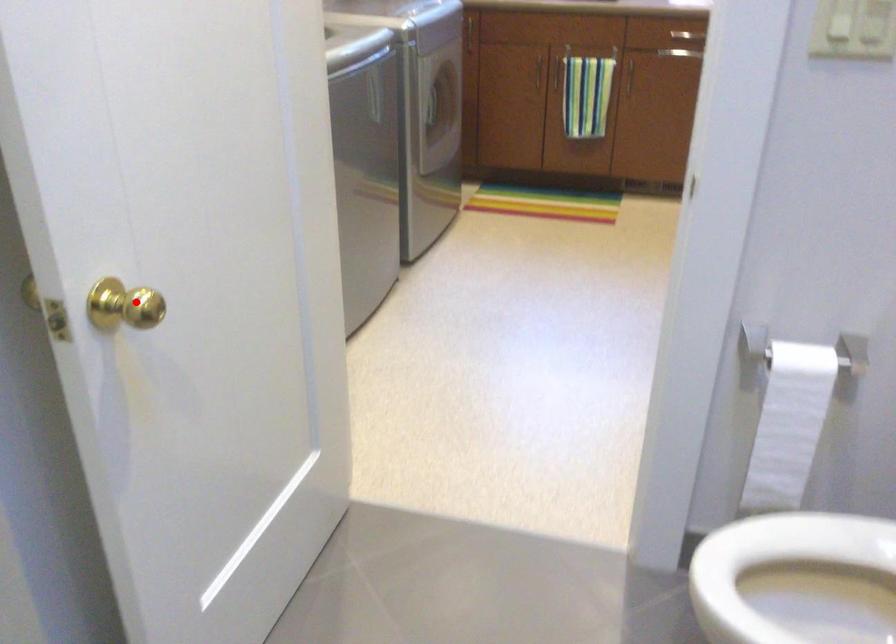
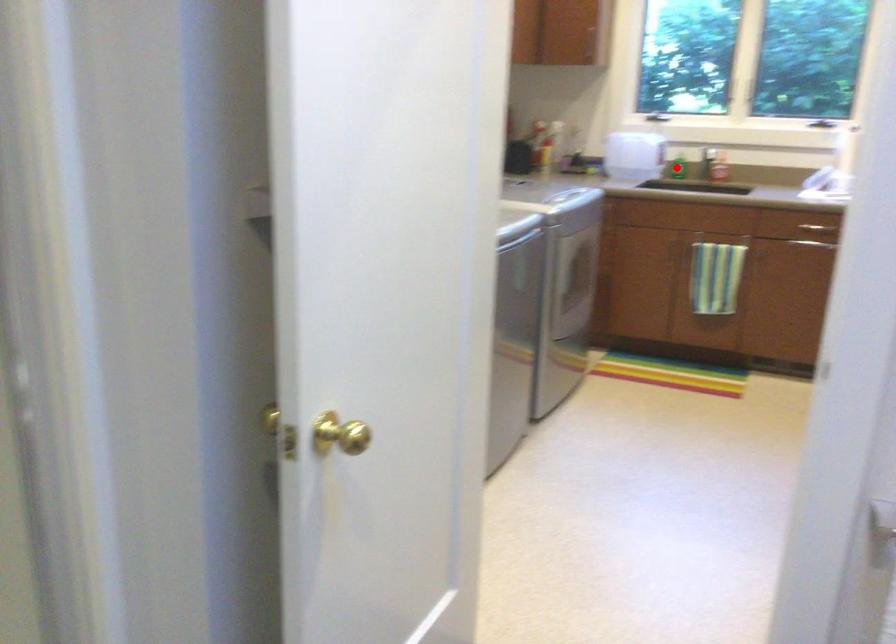
I am providing you with two images of the same scene from different viewpoints. A red point is marked on the first image and another point is marked on the second image. Does the point marked in image1 correspond to the same location as the one in image2?

No